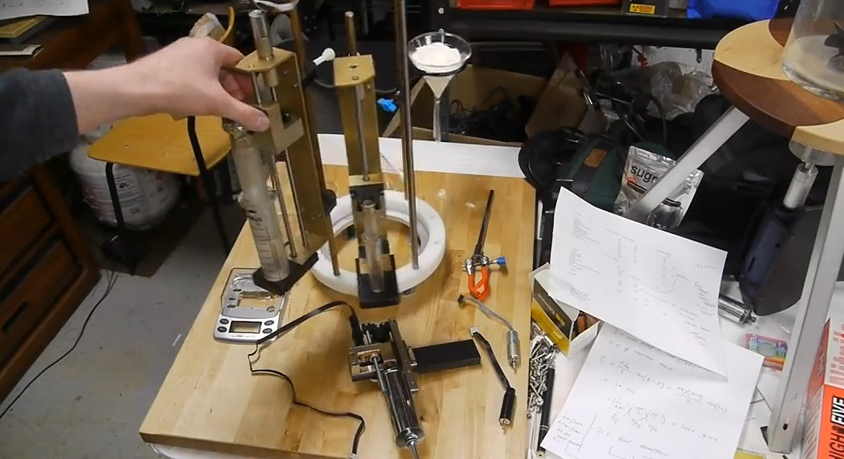
The height and width of the screenshot is (459, 844). In order to click on black shelving in this screenshot , I will do `click(603, 29)`.